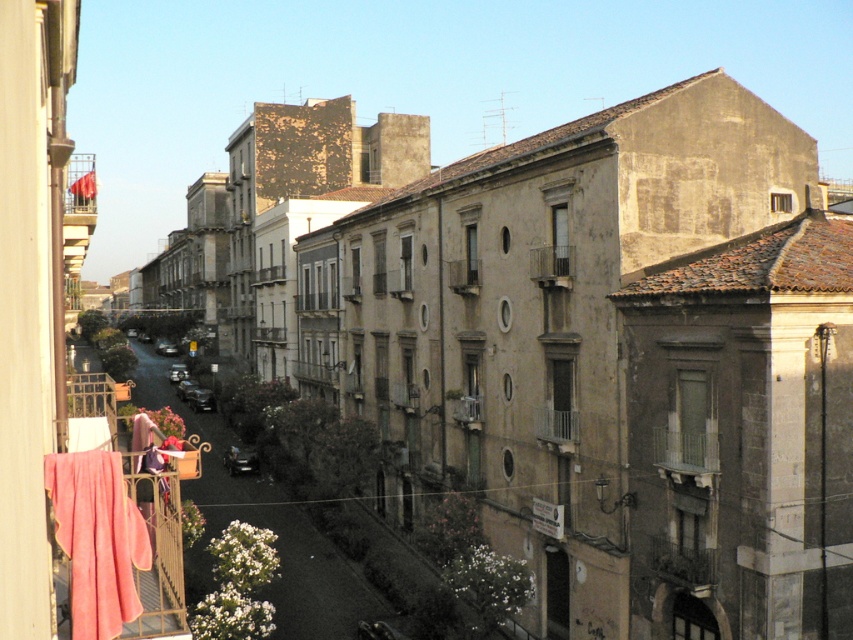
Based on the photo, you are a window cleaner with a 2.5 meter ladder. You need to clean the pink velvety towel at lower left and the metallic gray balcony at center. Which object requires a shorter ladder to reach?

The pink velvety towel at lower left requires a shorter ladder because it has a lesser width compared to the metallic gray balcony at center, so it is closer to the ground and easier to reach with a shorter ladder.

You are standing at the center of the street looking towards the buildings. There is a point marked at coordinates (97,540). What object is this point located on?

The point at (97,540) is located on the pink velvety towel at lower left.